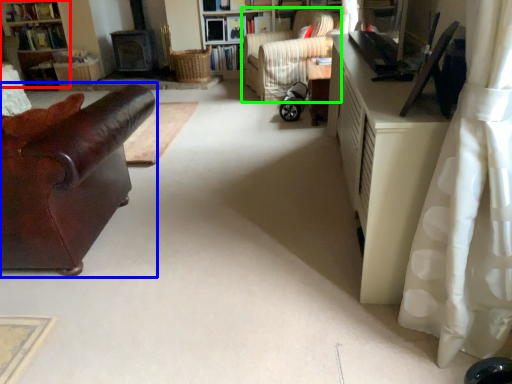
Question: Considering the real-world distances, which object is farthest from bookshelf (highlighted by a red box)? studio couch (highlighted by a blue box) or chair (highlighted by a green box)?

Choices:
 (A) studio couch
 (B) chair

Answer: (A)